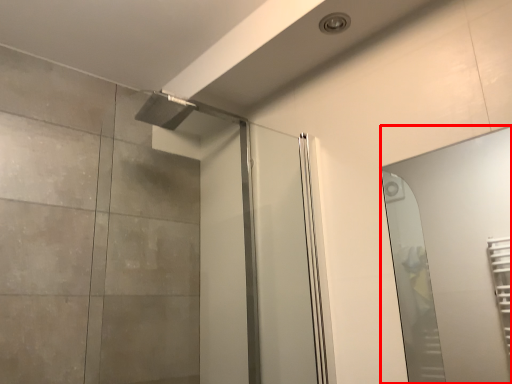
Question: From the image's perspective, what is the correct spatial positioning of mirror (annotated by the red box) in reference to screen door?

Choices:
 (A) above
 (B) below

Answer: (B)